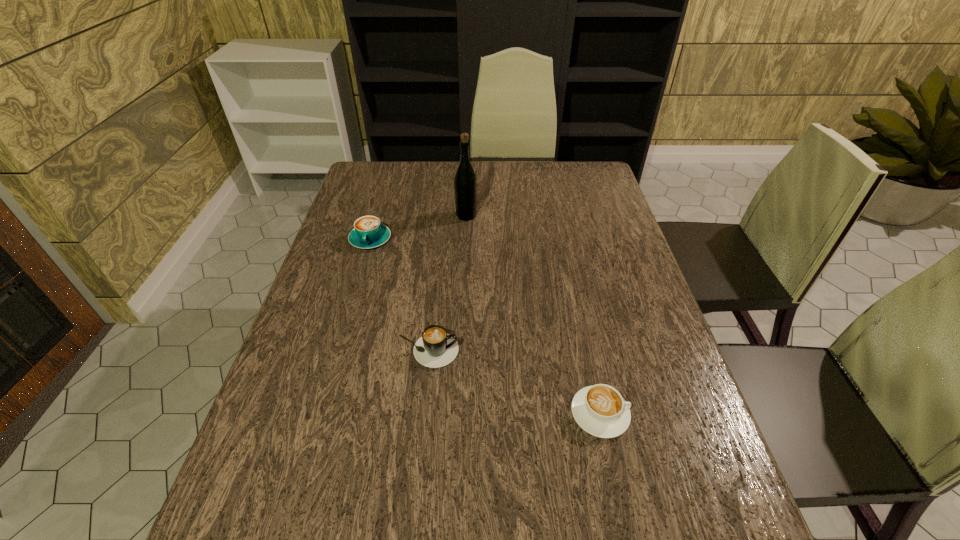
Identify the location of vacant space located 0.180m with the handle on the right side of the leftmost cappuccino. This screenshot has height=540, width=960. (353, 298).

This screenshot has height=540, width=960. In order to click on vacant space located on the side of the rightmost object with the handle in this screenshot , I will do pos(663,414).

Image resolution: width=960 pixels, height=540 pixels. What are the coordinates of `object that is at the left edge` in the screenshot? It's located at (368, 232).

You are a GUI agent. You are given a task and a screenshot of the screen. Output one action in this format:
    pyautogui.click(x=<x>, y=<y>)
    Task: Click on the object at the right edge
    This screenshot has height=540, width=960.
    Given the screenshot: What is the action you would take?
    [600, 410]

Locate an element on the screen. blank space at the far edge of the desktop is located at coordinates (429, 196).

You are a GUI agent. You are given a task and a screenshot of the screen. Output one action in this format:
    pyautogui.click(x=<x>, y=<y>)
    Task: Click on the free space at the left edge
    
    Given the screenshot: What is the action you would take?
    pyautogui.click(x=283, y=373)

Locate an element on the screen. This screenshot has height=540, width=960. free space at the right edge of the desktop is located at coordinates (661, 321).

Locate an element on the screen. The image size is (960, 540). vacant space at the far left corner of the desktop is located at coordinates (379, 166).

The image size is (960, 540). I want to click on vacant area that lies between the nearest cappuccino and the farthest cappuccino, so click(485, 327).

This screenshot has height=540, width=960. In order to click on vacant area between the shortest cappuccino and the tallest object in this screenshot , I will do `click(533, 315)`.